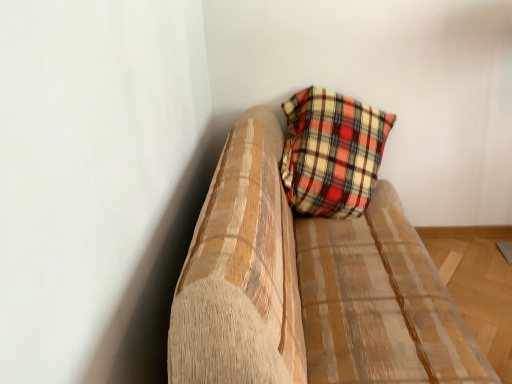
This screenshot has height=384, width=512. In order to click on plaid fabric pillow at upper right in this screenshot , I will do `click(309, 287)`.

In order to face plaid fabric pillow at upper right, should I rotate leftwards or rightwards?

It's best to rotate right around 11.555 degrees.

This screenshot has height=384, width=512. Describe the element at coordinates (309, 287) in the screenshot. I see `plaid fabric pillow at upper right` at that location.

The height and width of the screenshot is (384, 512). Find the location of `plaid fabric pillow at upper right`. plaid fabric pillow at upper right is located at coordinates (309, 287).